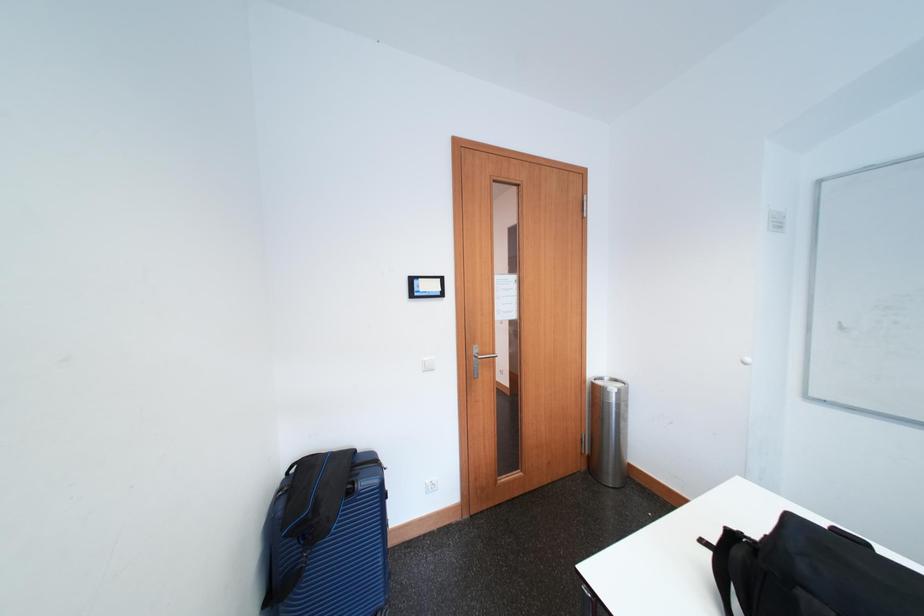
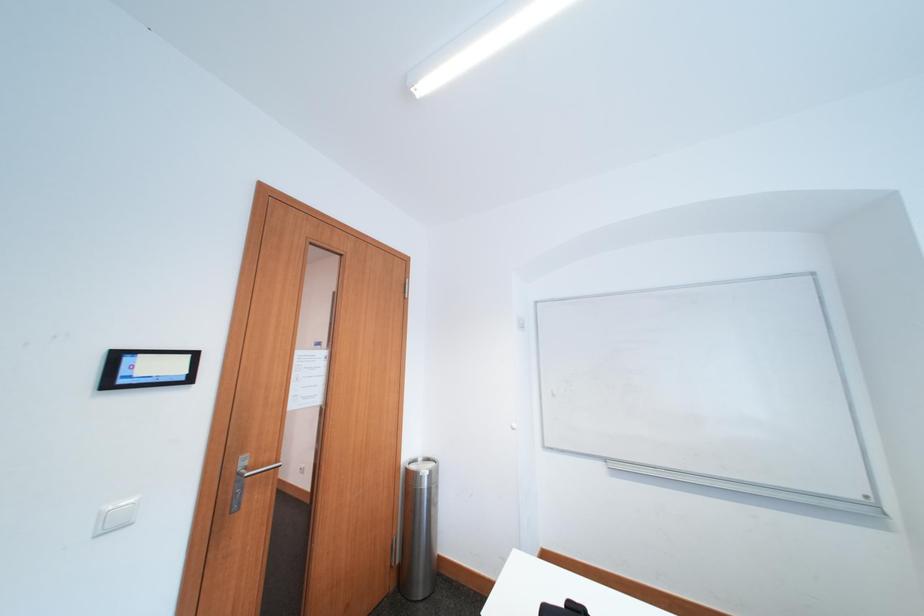
Question: The images are taken continuously from a first-person perspective. In which direction is your viewpoint rotating?

Choices:
 (A) Left
 (B) Right
 (C) Up
 (D) Down

Answer: (B)